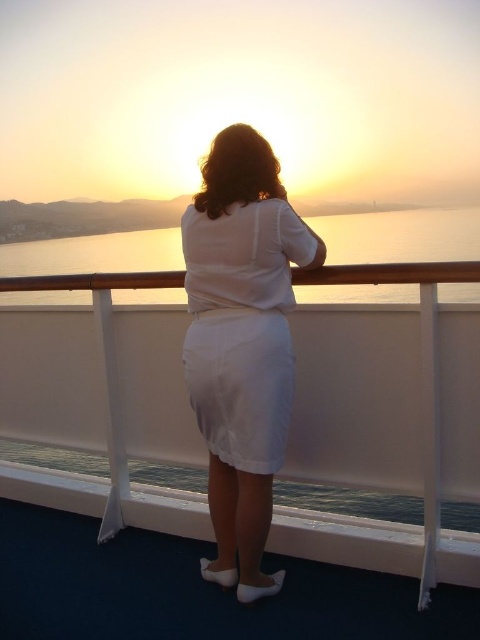
Can you confirm if white satin skirt at center is positioned to the right of matte water at center?

Correct, you'll find white satin skirt at center to the right of matte water at center.

Is white satin skirt at center below matte water at center?

Correct, white satin skirt at center is located below matte water at center.

What do you see at coordinates (241, 342) in the screenshot? Image resolution: width=480 pixels, height=640 pixels. I see `white satin skirt at center` at bounding box center [241, 342].

Where is `white satin skirt at center`? The width and height of the screenshot is (480, 640). white satin skirt at center is located at coordinates (241, 342).